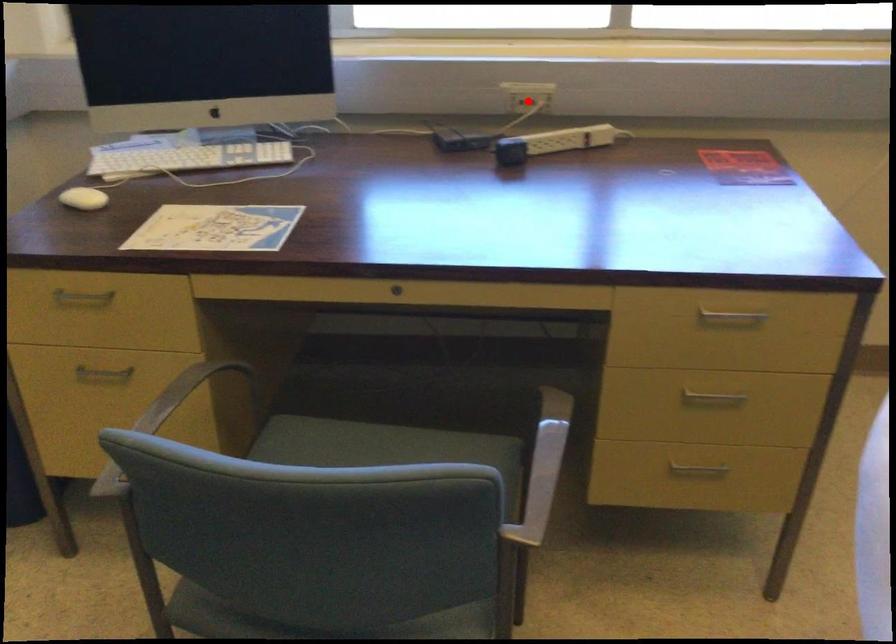
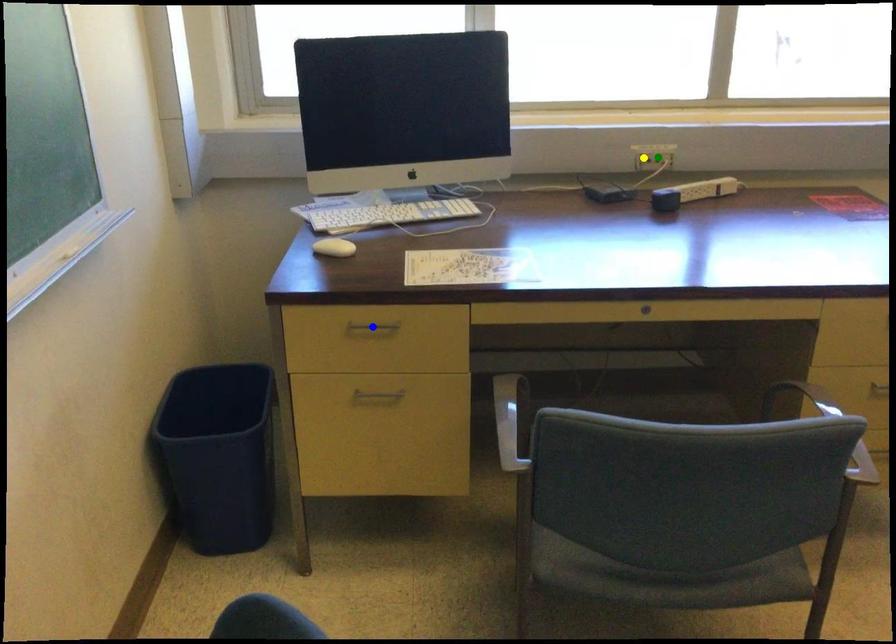
Question: I am providing you with two images of the same scene from different viewpoints. A red point is marked on the first image. You are given multiple points on the second image. Which spot in image 2 lines up with the point in image 1?

Choices:
 (A) green point
 (B) yellow point
 (C) blue point

Answer: (A)